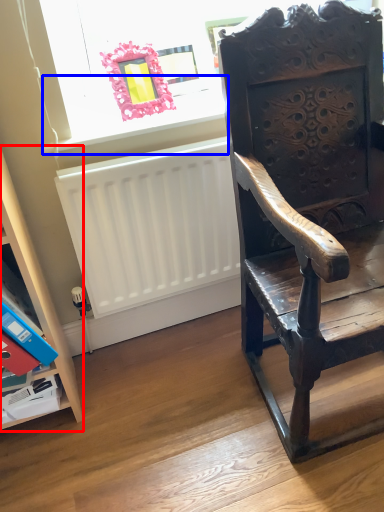
Question: Which of the following is the farthest to the observer, shelf (highlighted by a red box) or window sill (highlighted by a blue box)?

Choices:
 (A) shelf
 (B) window sill

Answer: (B)